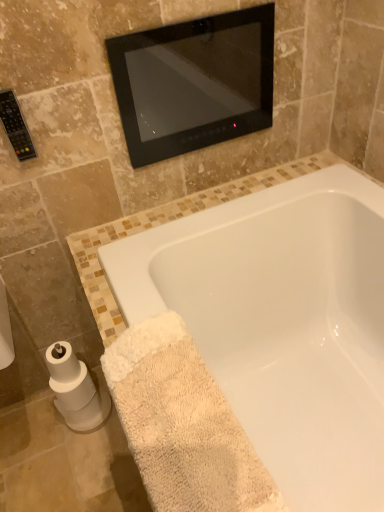
Question: Does beige terry cloth bath towel at lower right lie in front of black glass mirror at upper center?

Choices:
 (A) no
 (B) yes

Answer: (B)

Question: Does beige terry cloth bath towel at lower right have a lesser height compared to black glass mirror at upper center?

Choices:
 (A) no
 (B) yes

Answer: (A)

Question: Does beige terry cloth bath towel at lower right have a greater height compared to black glass mirror at upper center?

Choices:
 (A) no
 (B) yes

Answer: (B)

Question: Is the depth of beige terry cloth bath towel at lower right greater than that of black glass mirror at upper center?

Choices:
 (A) no
 (B) yes

Answer: (A)

Question: Is beige terry cloth bath towel at lower right thinner than black glass mirror at upper center?

Choices:
 (A) yes
 (B) no

Answer: (B)

Question: Is white matte toilet paper at lower left in front of or behind black glass mirror at upper center in the image?

Choices:
 (A) front
 (B) behind

Answer: (B)

Question: Is white matte toilet paper at lower left bigger or smaller than black glass mirror at upper center?

Choices:
 (A) small
 (B) big

Answer: (B)

Question: Is white matte toilet paper at lower left inside the boundaries of black glass mirror at upper center, or outside?

Choices:
 (A) inside
 (B) outside

Answer: (B)

Question: From their relative heights in the image, would you say white matte toilet paper at lower left is taller or shorter than black glass mirror at upper center?

Choices:
 (A) tall
 (B) short

Answer: (A)

Question: From their relative heights in the image, would you say white glossy bathtub at lower center is taller or shorter than white matte toilet paper at lower left?

Choices:
 (A) tall
 (B) short

Answer: (A)

Question: Looking at their shapes, would you say white glossy bathtub at lower center is wider or thinner than white matte toilet paper at lower left?

Choices:
 (A) wide
 (B) thin

Answer: (A)

Question: In terms of size, does white glossy bathtub at lower center appear bigger or smaller than white matte toilet paper at lower left?

Choices:
 (A) big
 (B) small

Answer: (A)

Question: From a real-world perspective, is white glossy bathtub at lower center physically located above or below white matte toilet paper at lower left?

Choices:
 (A) below
 (B) above

Answer: (B)

Question: Considering the positions of white matte toilet paper at lower left and white glossy bathtub at lower center in the image, is white matte toilet paper at lower left taller or shorter than white glossy bathtub at lower center?

Choices:
 (A) short
 (B) tall

Answer: (A)

Question: Is white matte toilet paper at lower left bigger or smaller than white glossy bathtub at lower center?

Choices:
 (A) big
 (B) small

Answer: (B)